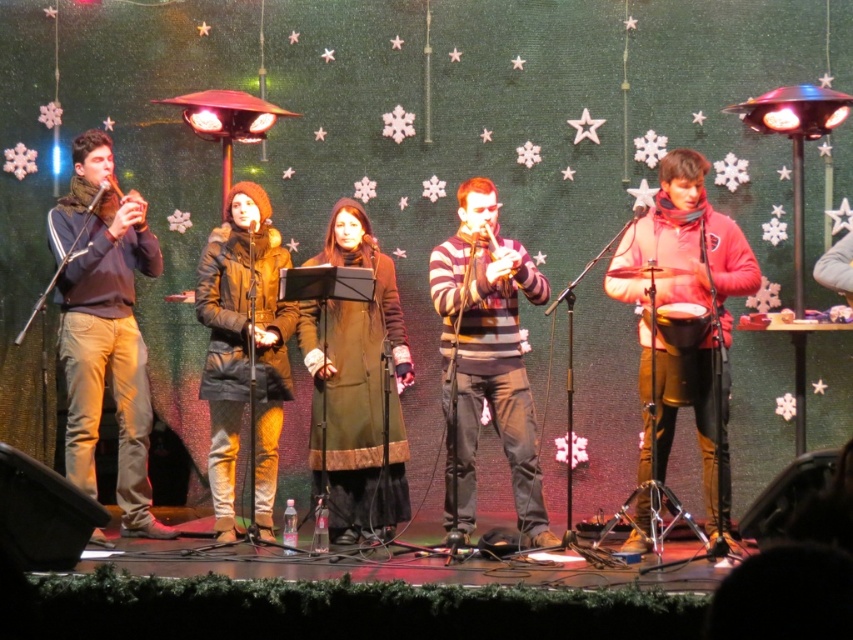
Looking at this image, you are a photographer setting up a camera on the stage. You notice the striped sweater at center and the matte wood flute at left. Which object should you focus on if you want to capture the wider subject?

The striped sweater at center has a larger width than the matte wood flute at left, so you should focus on the striped sweater at center to capture the wider subject.

You are sitting in the audience and want to know which of the two points, point (x=682, y=230) or point (x=241, y=262), is closer to you. Can you determine this based on the stage setup?

Point (x=682, y=230) is closer to the viewer than point (x=241, y=262).

You are a stagehand preparing to move the pink matte drum at right and the dark brown leather coat at center. According to the stage layout, which object is positioned higher relative to the other?

The pink matte drum at right is located above the dark brown leather coat at center, so the drum is higher up.